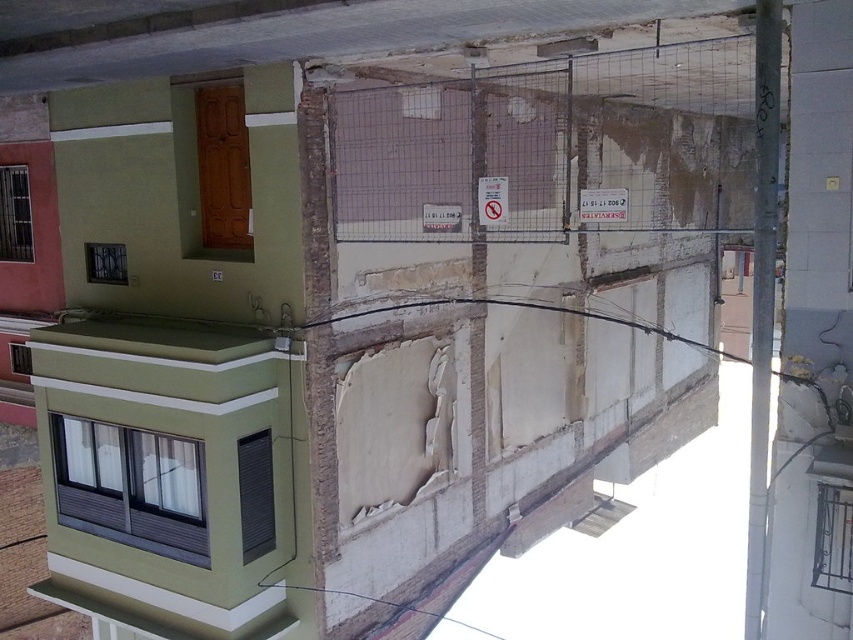
Question: Is white paper sign at center further to camera compared to white plastic sign at center?

Choices:
 (A) no
 (B) yes

Answer: (A)

Question: Is white paper sign at center closer to camera compared to white plastic sign at center?

Choices:
 (A) yes
 (B) no

Answer: (A)

Question: In this image, where is white paper sign at center located relative to white plastic sign at center?

Choices:
 (A) right
 (B) left

Answer: (A)